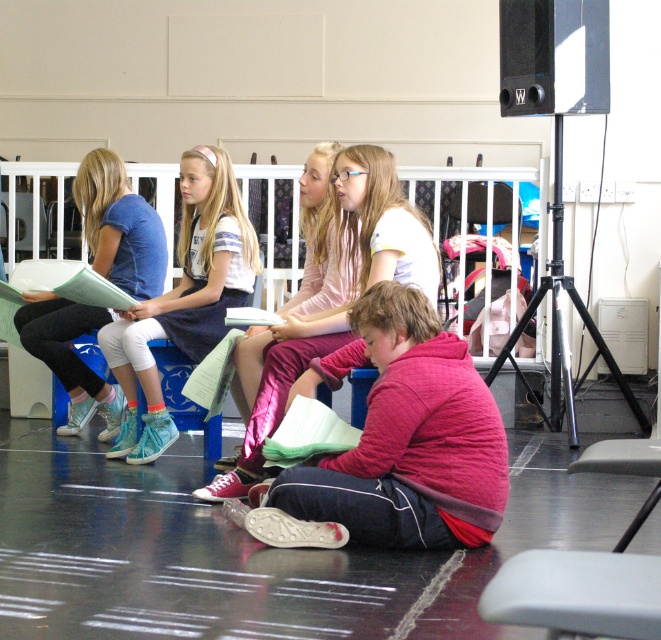
This screenshot has width=661, height=640. In order to click on pink quilted jacket at center in this screenshot , I will do `click(407, 436)`.

Is pink quilted jacket at center thinner than white fabric shirt at center?

Yes.

At what (x,y) coordinates should I click in order to perform the action: click on pink quilted jacket at center. Please return your answer as a coordinate pair (x, y). Looking at the image, I should click on (407, 436).

Is pink quilted jacket at center bigger than matte blue shirt at left?

Correct, pink quilted jacket at center is larger in size than matte blue shirt at left.

Is point (373, 468) closer to viewer compared to point (71, 332)?

Yes, it is.

Identify the location of pink quilted jacket at center. [407, 436].

From the picture: Can you confirm if white matte dress at upper left is wider than matte blue shirt at left?

Yes, white matte dress at upper left is wider than matte blue shirt at left.

Measure the distance between point (245, 216) and camera.

A distance of 6.61 meters exists between point (245, 216) and camera.

Between point (194, 163) and point (136, 240), which one is positioned in front?

Positioned in front is point (194, 163).

The width and height of the screenshot is (661, 640). What are the coordinates of `white matte dress at upper left` in the screenshot? It's located at (184, 298).